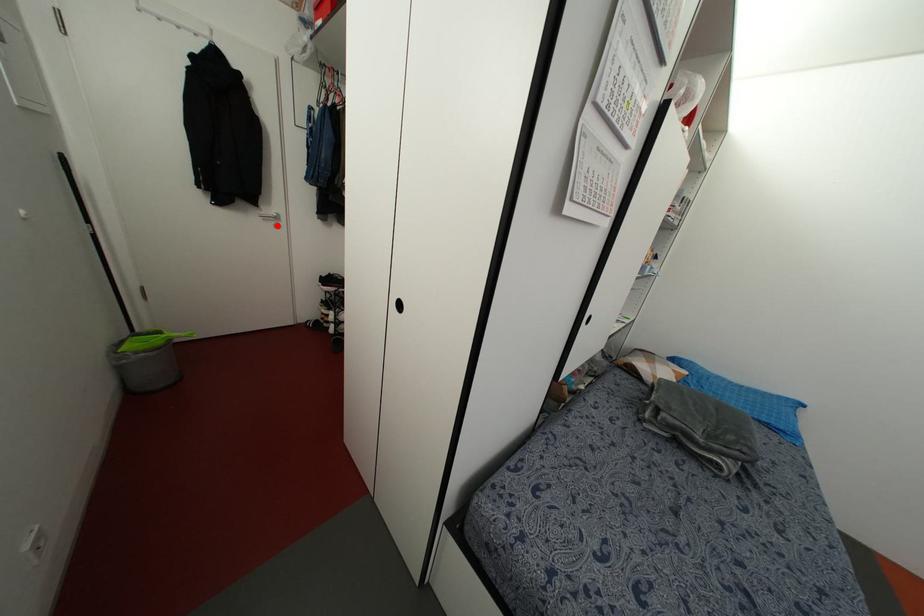
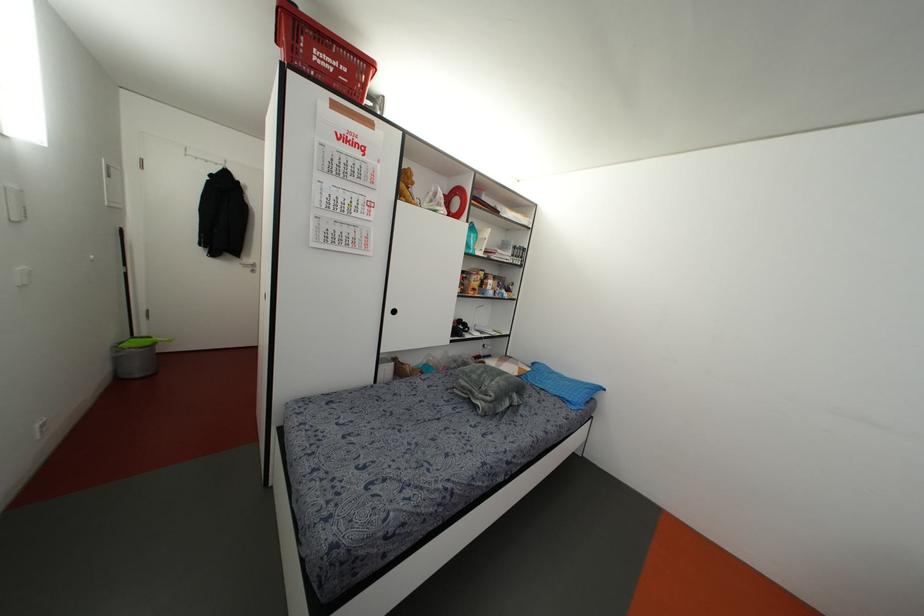
Where in the second image is the point corresponding to the highlighted location from the first image?

(252, 270)